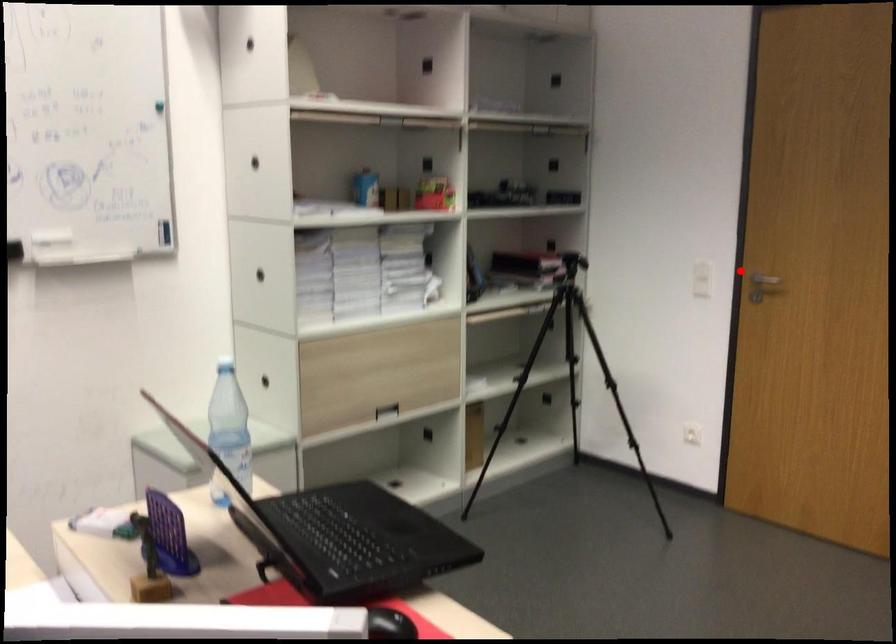
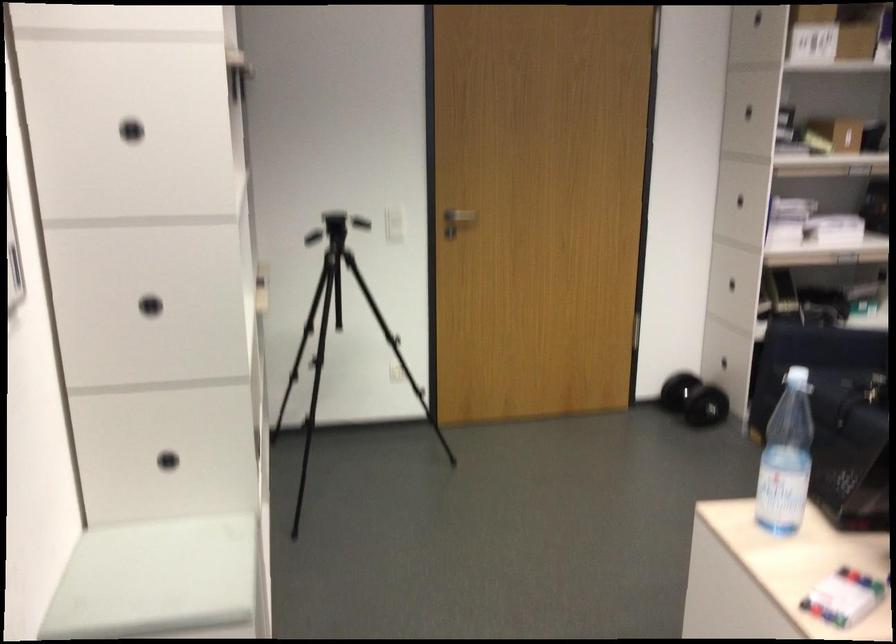
Where in the second image is the point corresponding to the highlighted location from the first image?

(393, 214)